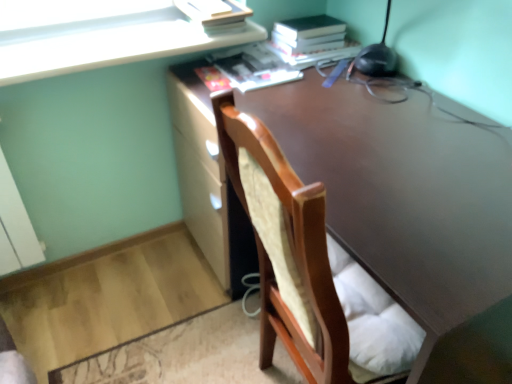
This screenshot has height=384, width=512. What are the coordinates of `empty space that is ontop of matte paper book at upper center` in the screenshot? It's located at (241, 60).